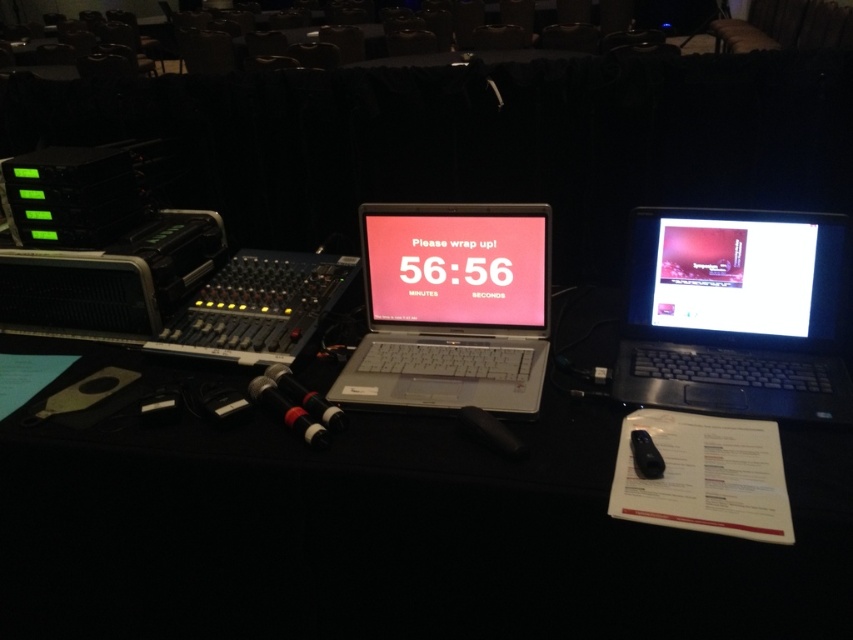
Who is positioned more to the right, black plastic laptop at right or silver metallic laptop at center?

black plastic laptop at right is more to the right.

Can you confirm if black plastic laptop at right is taller than silver metallic laptop at center?

No.

The image size is (853, 640). What are the coordinates of `black plastic laptop at right` in the screenshot? It's located at (733, 314).

Is point (440, 280) more distant than point (724, 285)?

Yes, it is behind point (724, 285).

Is pink glossy screen at center further to the viewer compared to matte black monitor at right?

Yes, it is behind matte black monitor at right.

Which is in front, point (521, 289) or point (711, 320)?

Point (711, 320) is more forward.

At what (x,y) coordinates should I click in order to perform the action: click on pink glossy screen at center. Please return your answer as a coordinate pair (x, y). The height and width of the screenshot is (640, 853). Looking at the image, I should click on (457, 266).

Does black plastic laptop at right have a larger size compared to matte black monitor at right?

Yes.

Who is more forward, (x=695, y=248) or (x=704, y=241)?

Positioned in front is point (x=704, y=241).

Between point (737, 406) and point (786, 225), which one is positioned in front?

Point (737, 406) is in front.

Where is `black plastic laptop at right`? The height and width of the screenshot is (640, 853). black plastic laptop at right is located at coordinates (733, 314).